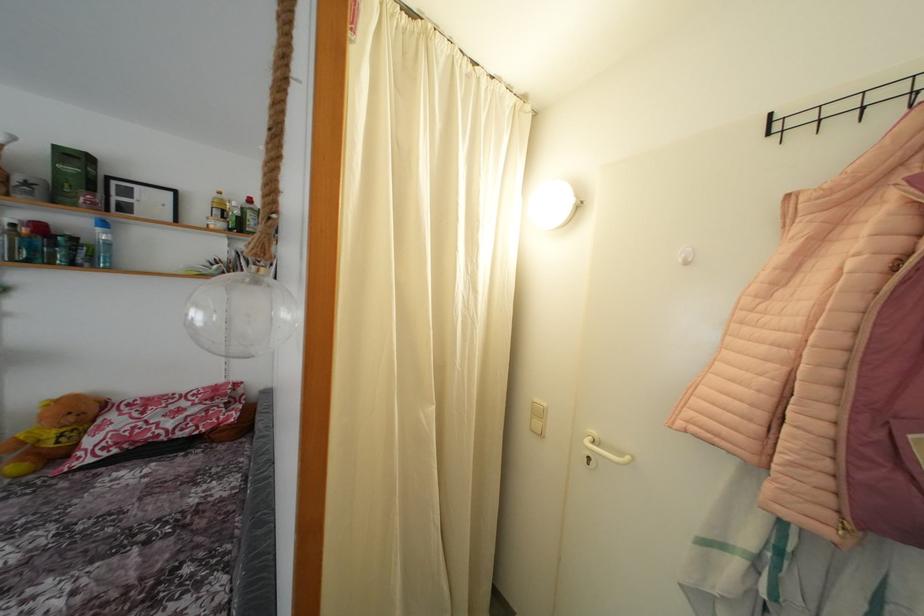
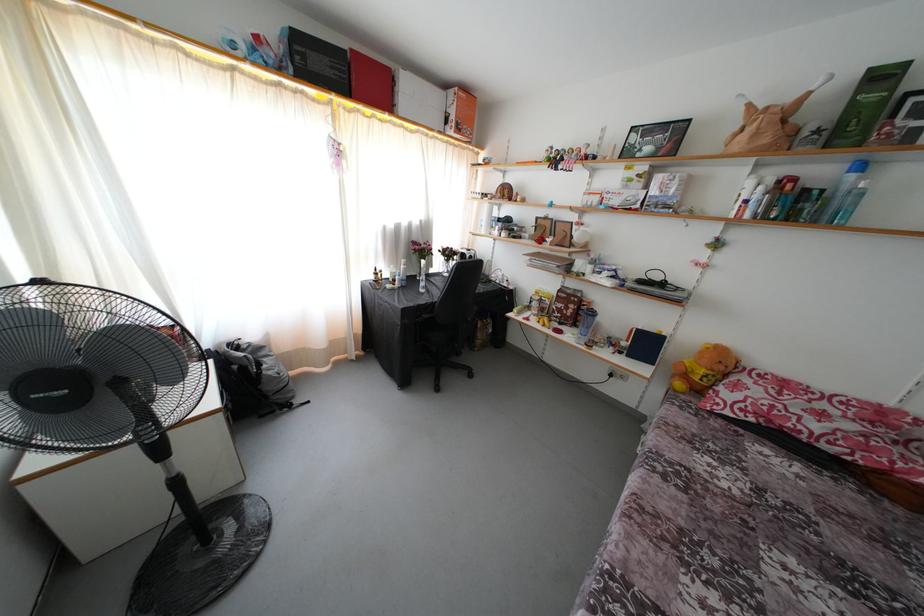
Locate, in the second image, the point that corresponds to pixel 126 421 in the first image.

(760, 389)